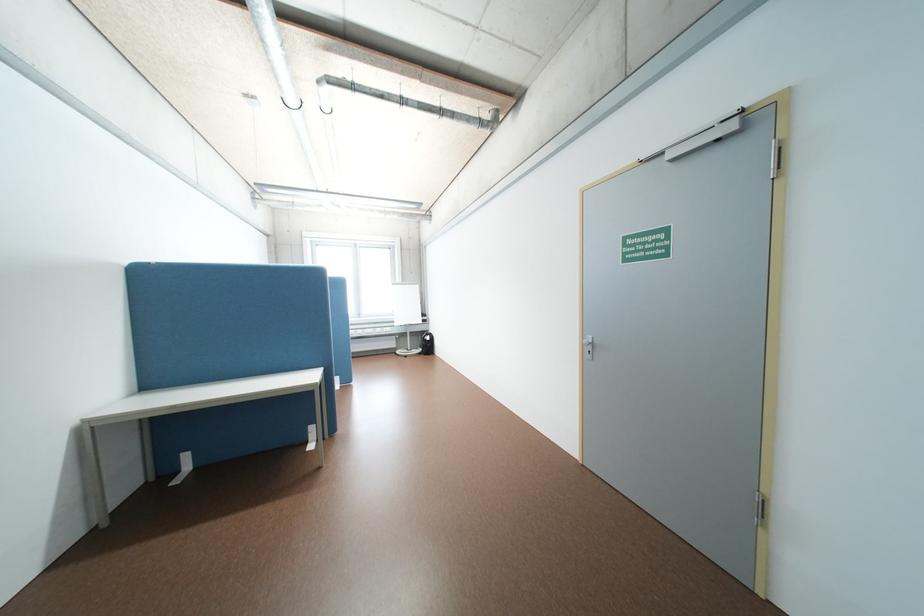
You are a GUI agent. You are given a task and a screenshot of the screen. Output one action in this format:
    pyautogui.click(x=<x>, y=<y>)
    Task: Click on the metal door handle
    Image resolution: width=924 pixels, height=616 pixels.
    Given the screenshot: What is the action you would take?
    pyautogui.click(x=588, y=347)